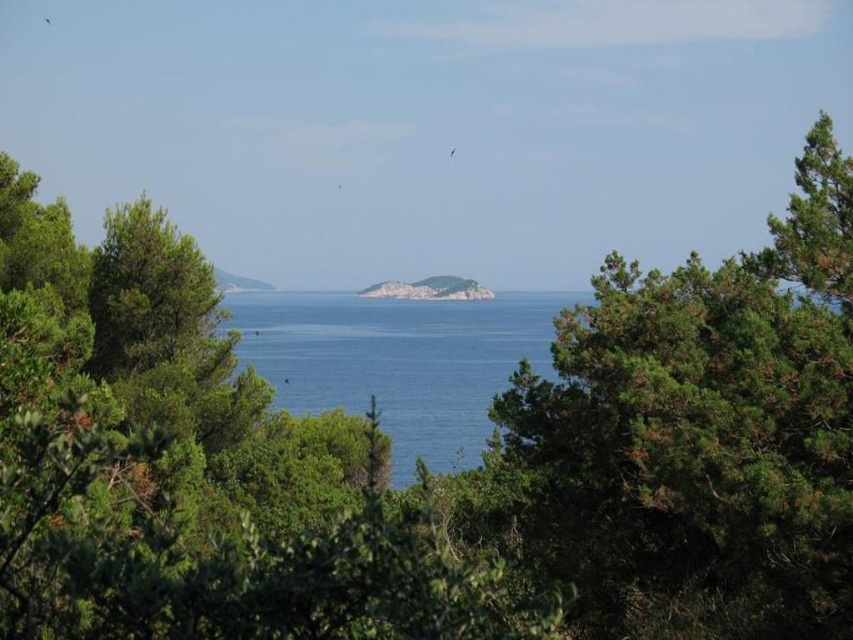
Between blue water at center and rugged stone island at center, which one has more height?

blue water at center is taller.

Which is below, blue water at center or rugged stone island at center?

blue water at center is below.

Which is in front, point (436, 320) or point (448, 296)?

Point (436, 320) is in front.

Locate an element on the screen. blue water at center is located at coordinates (397, 360).